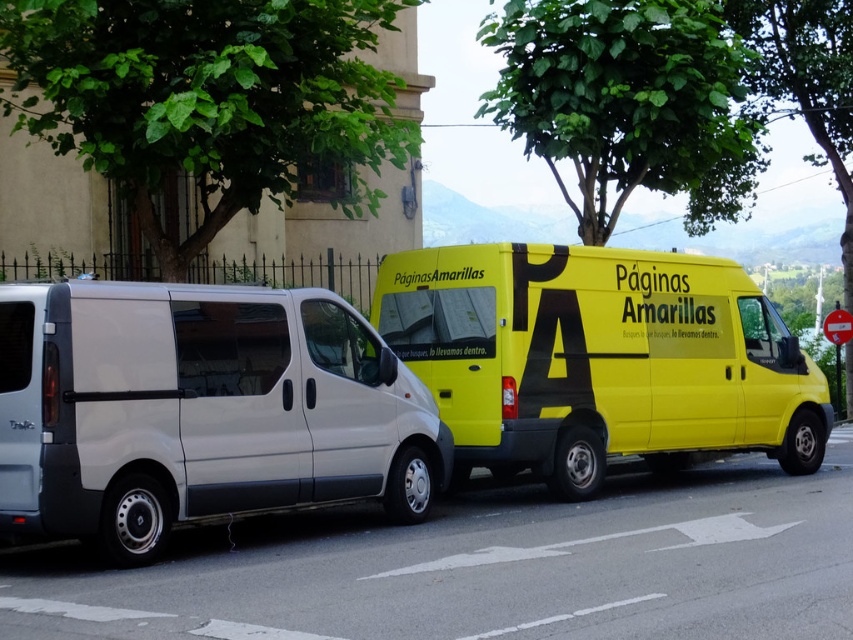
Which is behind, point (152, 300) or point (767, 342)?

The point (767, 342) is more distant.

Measure the distance between matte white van at left and camera.

6.92 meters

This screenshot has height=640, width=853. I want to click on matte white van at left, so (199, 412).

Identify the location of matte white van at left. The height and width of the screenshot is (640, 853). (199, 412).